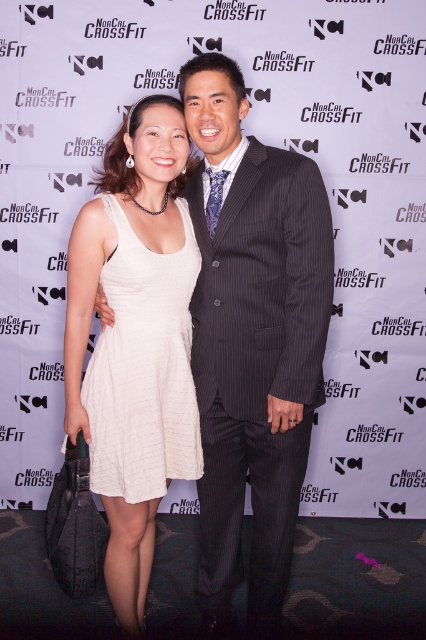
Question: Can you confirm if white satin dress at center is positioned above pinstriped wool suit at center?

Choices:
 (A) no
 (B) yes

Answer: (B)

Question: Which point is closer to the camera?

Choices:
 (A) white knit dress at center
 (B) white satin dress at center

Answer: (B)

Question: Where is white satin dress at center located in relation to pinstriped wool suit at center in the image?

Choices:
 (A) above
 (B) below

Answer: (A)

Question: Is pinstriped wool suit at center above white knit dress at center?

Choices:
 (A) yes
 (B) no

Answer: (B)

Question: Which object is the closest to the white satin dress at center?

Choices:
 (A) pinstriped wool suit at center
 (B) white textured dress at center
 (C) white knit dress at center

Answer: (A)

Question: Which point is farther from the camera taking this photo?

Choices:
 (A) click(327, 296)
 (B) click(98, 394)

Answer: (B)